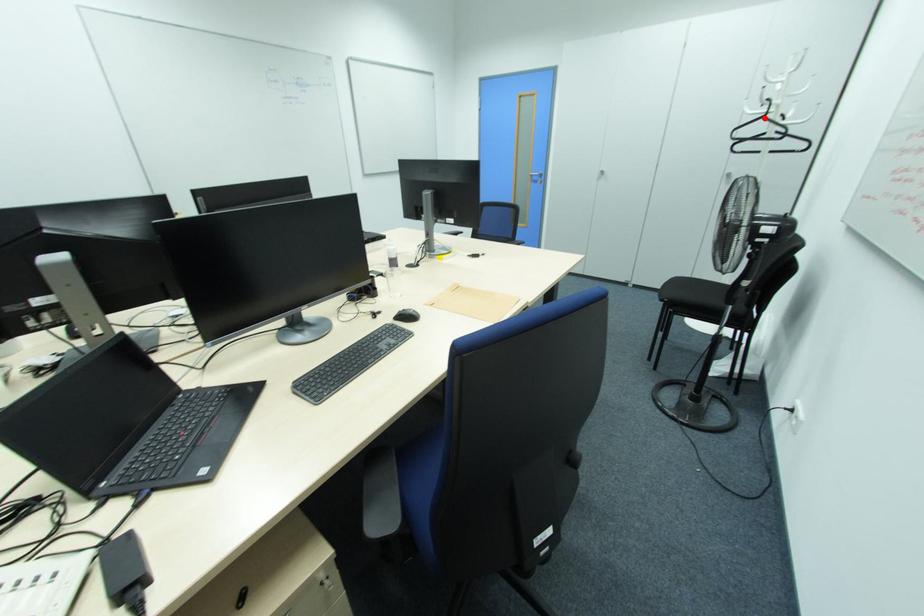
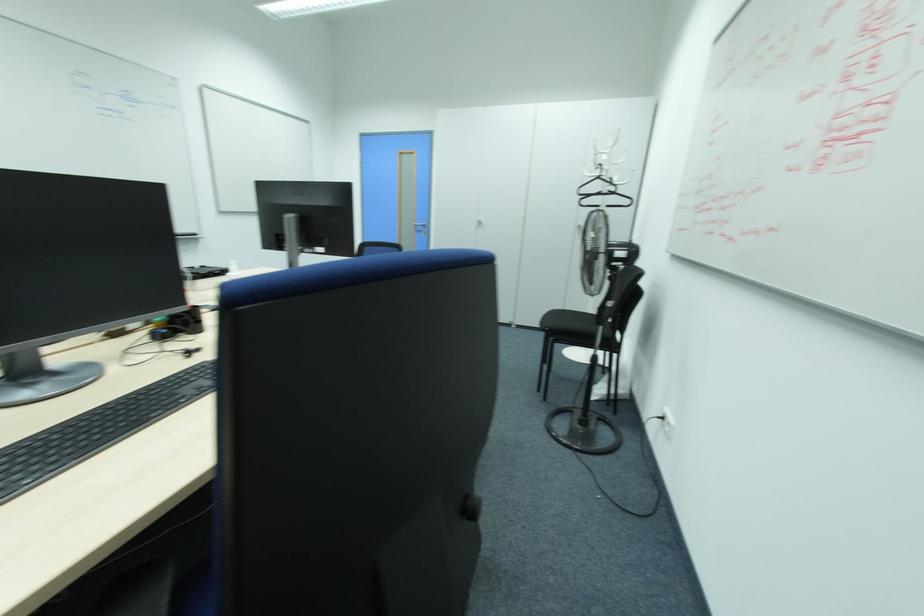
Question: I am providing you with two images of the same scene from different viewpoints. A red point is shown in image1. For the corresponding object point in image2, is it positioned nearer or farther from the camera?

Choices:
 (A) Nearer
 (B) Farther

Answer: (A)